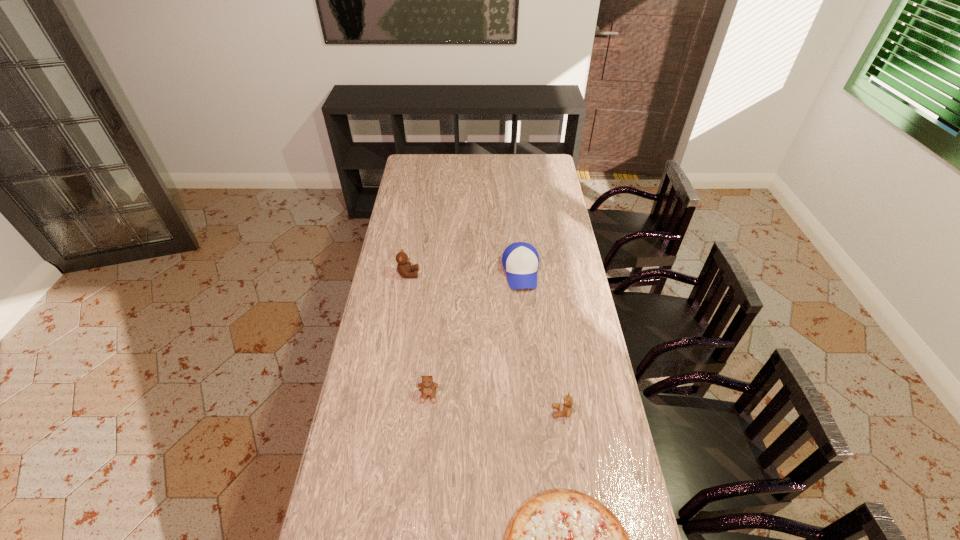
The width and height of the screenshot is (960, 540). I want to click on the closest teddy bear to the tallest teddy bear, so click(428, 388).

Point out which teddy bear is positioned as the second nearest to the nearest object. Please provide its 2D coordinates. Your answer should be formatted as a tuple, i.e. [(x, y)], where the tuple contains the x and y coordinates of a point satisfying the conditions above.

[(428, 388)]

Locate an element on the screen. The width and height of the screenshot is (960, 540). vacant space that satisfies the following two spatial constraints: 1. on the front-facing side of the baseball cap; 2. on the face of the farthest teddy bear is located at coordinates (521, 274).